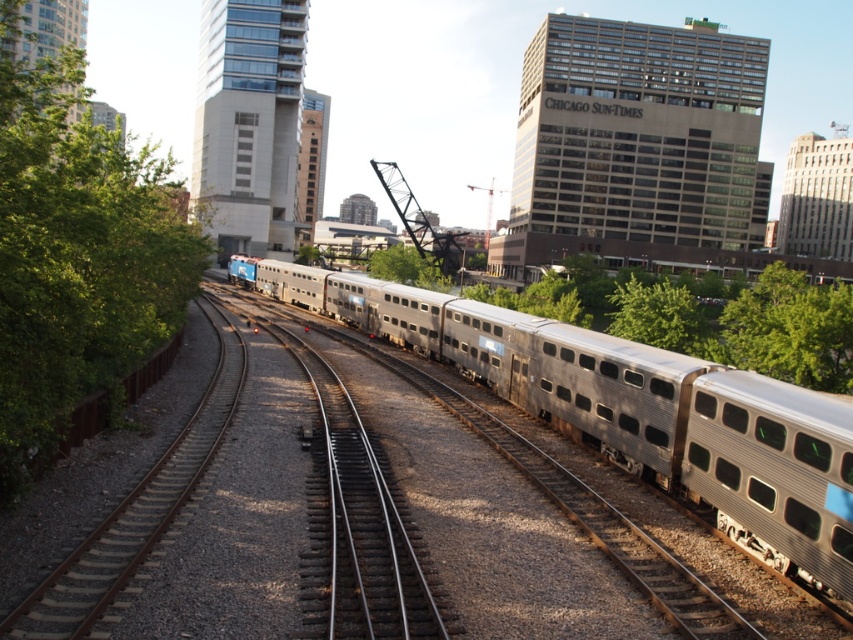
Which of these two, silver metallic train at center or green leafy tree at left, stands shorter?

With less height is silver metallic train at center.

Does silver metallic train at center come in front of green leafy tree at left?

No, it is behind green leafy tree at left.

Does point (791, 465) lie behind point (26, 308)?

Yes, it is behind point (26, 308).

You are a GUI agent. You are given a task and a screenshot of the screen. Output one action in this format:
    pyautogui.click(x=<x>, y=<y>)
    Task: Click on the silver metallic train at center
    The height and width of the screenshot is (640, 853).
    Given the screenshot: What is the action you would take?
    pyautogui.click(x=631, y=410)

Between point (18, 182) and point (624, 330), which one is positioned behind?

The point (624, 330) is more distant.

Which is in front, point (169, 289) or point (674, 300)?

Positioned in front is point (169, 289).

Identify the location of green leafy tree at left. The height and width of the screenshot is (640, 853). (74, 256).

Find the location of a particular element. The height and width of the screenshot is (640, 853). green leafy tree at left is located at coordinates (74, 256).

Does silver metallic train at center have a greater width compared to green leafy tree at center?

Yes.

Between point (544, 333) and point (665, 296), which one is positioned behind?

Positioned behind is point (665, 296).

Locate an element on the screen. The width and height of the screenshot is (853, 640). silver metallic train at center is located at coordinates (631, 410).